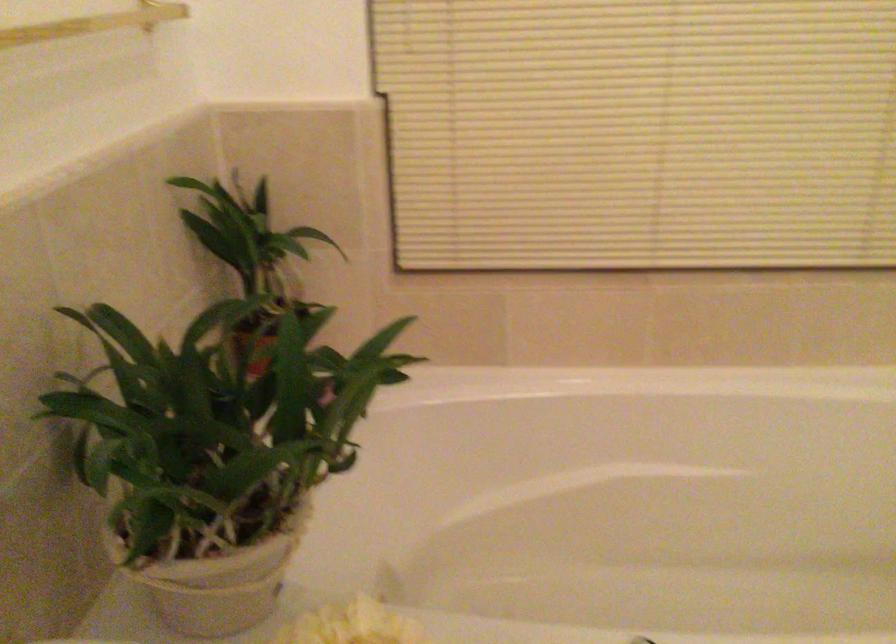
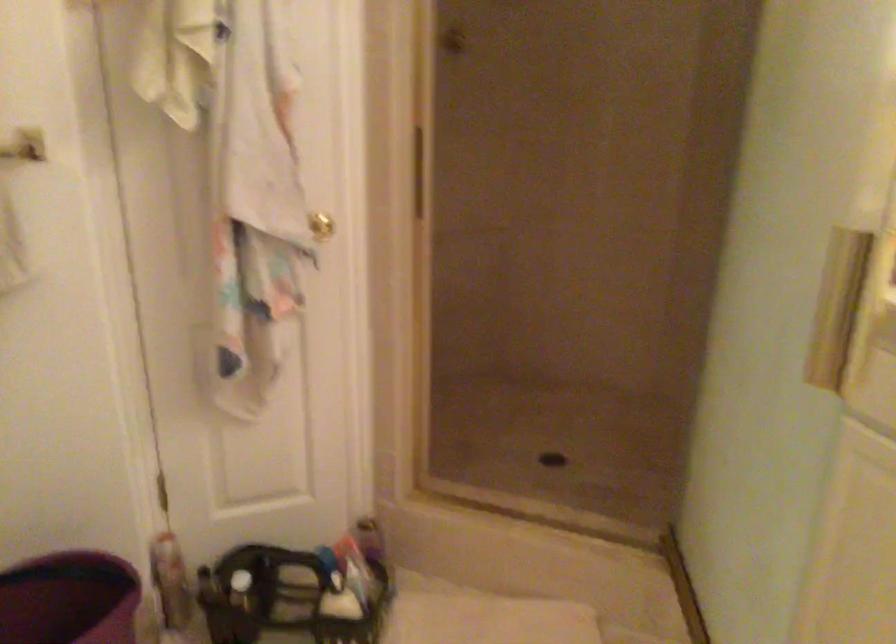
Based on the continuous images, in which direction is the camera rotating?

The rotation direction of the camera is right-down.